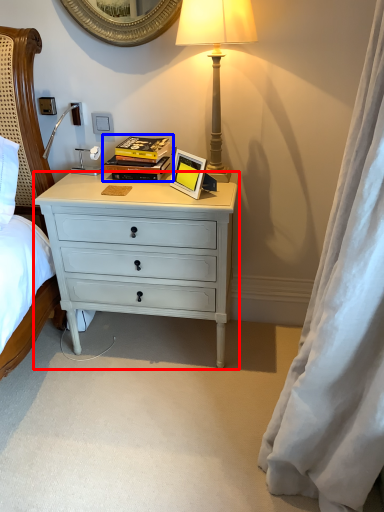
Question: Which object is closer to the camera taking this photo, desk (highlighted by a red box) or book (highlighted by a blue box)?

Choices:
 (A) desk
 (B) book

Answer: (A)